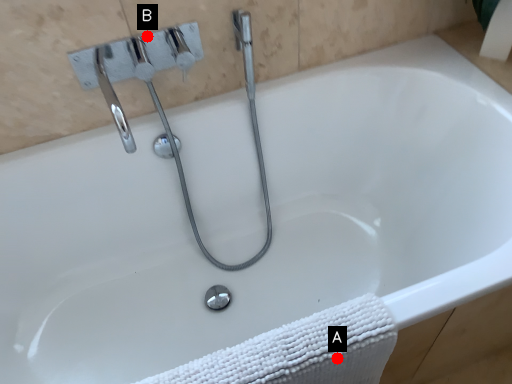
Question: Two points are circled on the image, labeled by A and B beside each circle. Among these points, which one is nearest to the camera?

Choices:
 (A) A is closer
 (B) B is closer

Answer: (A)